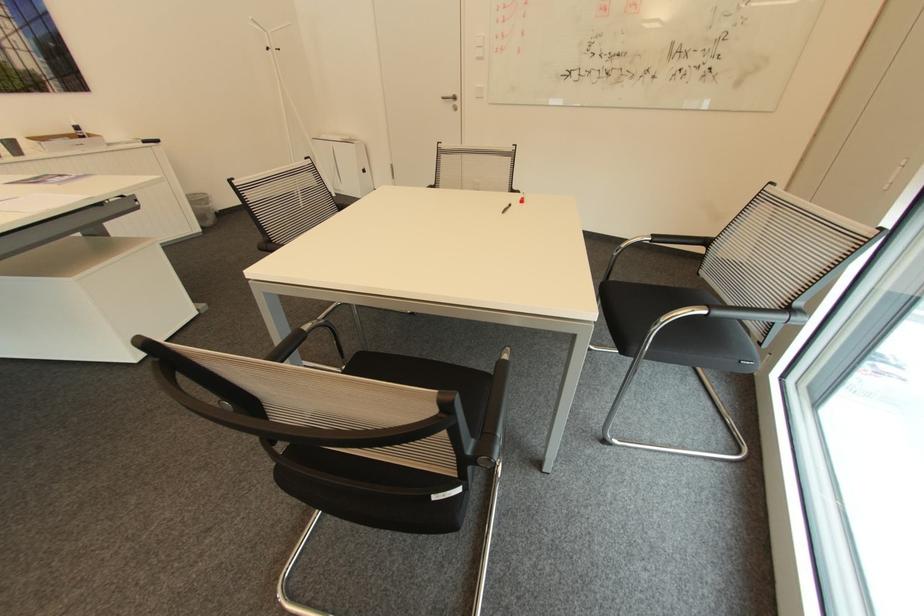
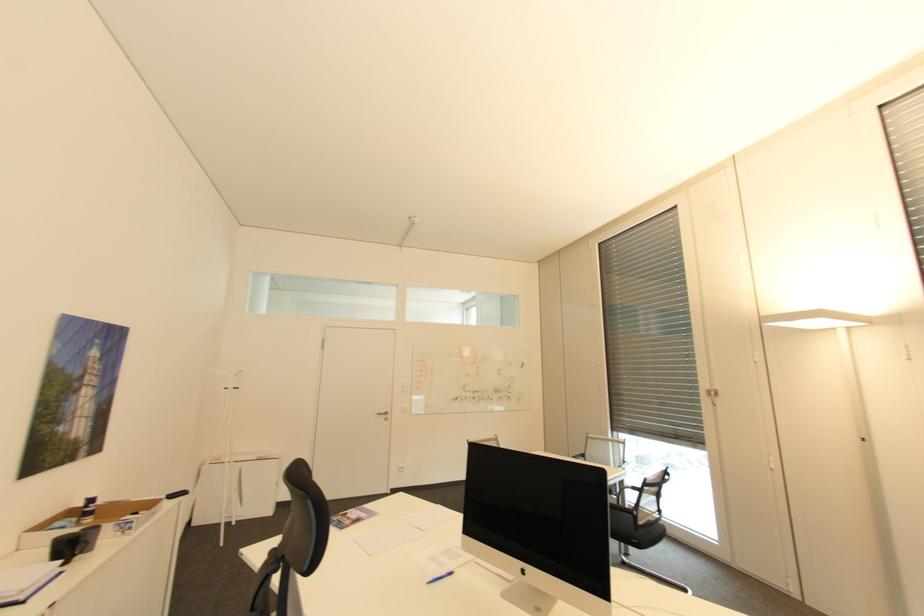
In the second image, find the point that corresponds to the point at 458,98 in the first image.

(391, 413)